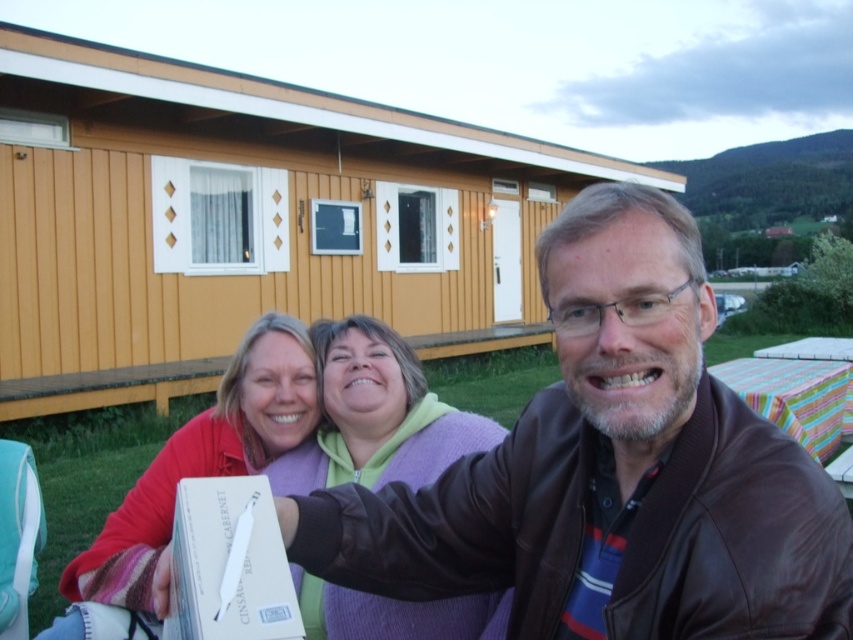
In the scene shown: Can you confirm if yellow wood cabin at center is taller than striped fabric picnic table at right?

Indeed, yellow wood cabin at center has a greater height compared to striped fabric picnic table at right.

This screenshot has width=853, height=640. Find the location of `yellow wood cabin at center`. yellow wood cabin at center is located at coordinates (245, 220).

Does point (47, 397) come farther from viewer compared to point (621, 224)?

Yes.

Measure the distance from yellow wood cabin at center to brown leather jacket at center.

yellow wood cabin at center and brown leather jacket at center are 8.82 meters apart.

Between point (253, 266) and point (775, 616), which one is positioned behind?

The point (253, 266) is more distant.

Identify the location of yellow wood cabin at center. (245, 220).

Which is more to the right, brown leather jacket at center or purple fleece sweater at center?

Positioned to the right is brown leather jacket at center.

Who is lower down, brown leather jacket at center or purple fleece sweater at center?

Positioned lower is purple fleece sweater at center.

Which is in front, point (714, 548) or point (415, 428)?

Point (714, 548) is more forward.

The height and width of the screenshot is (640, 853). In order to click on brown leather jacket at center in this screenshot , I will do `click(611, 472)`.